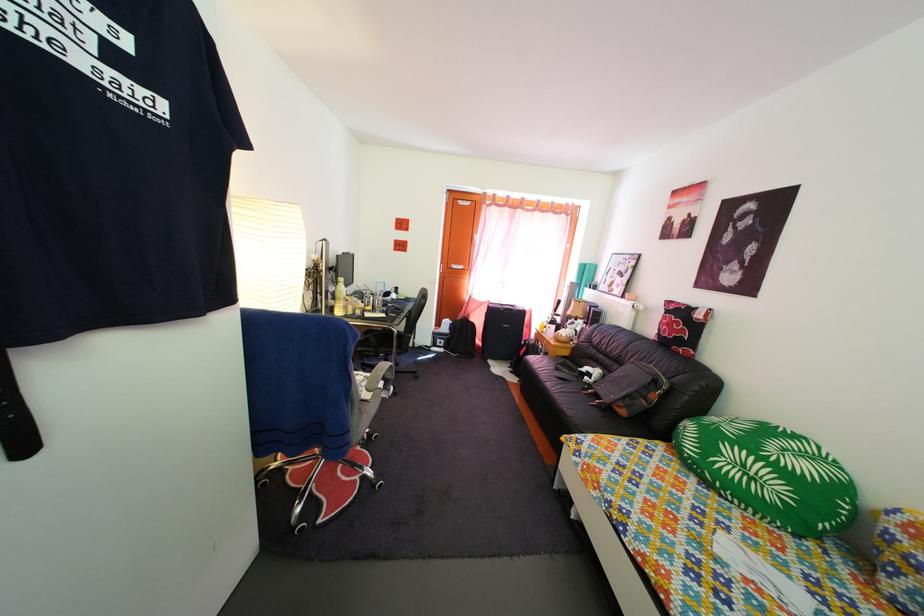
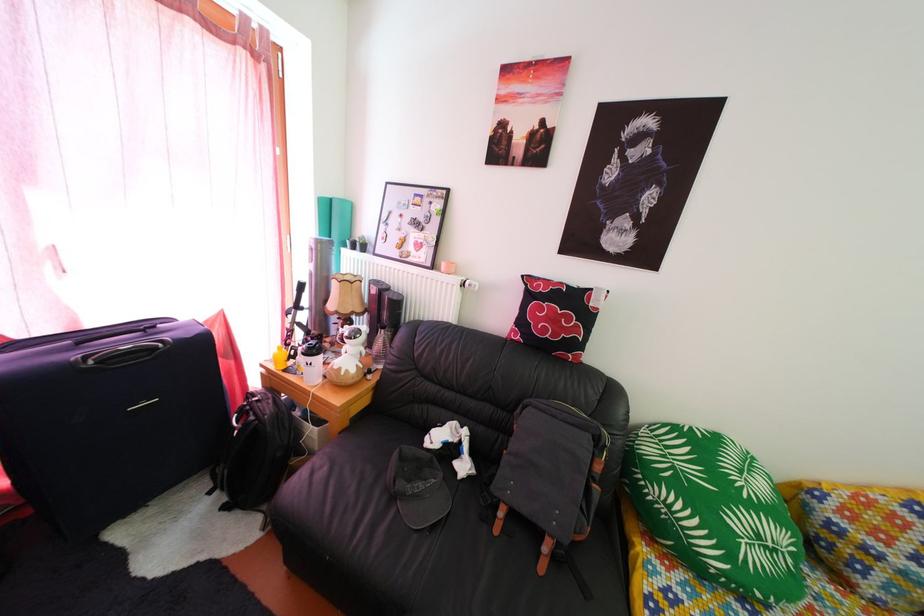
Locate, in the second image, the point that corresponds to pixel 578 371 in the first image.

(419, 458)